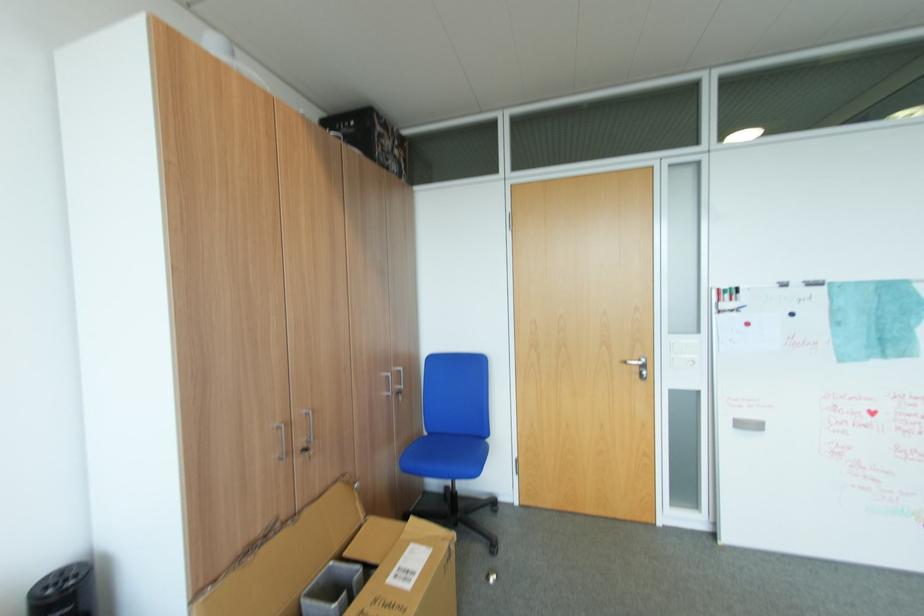
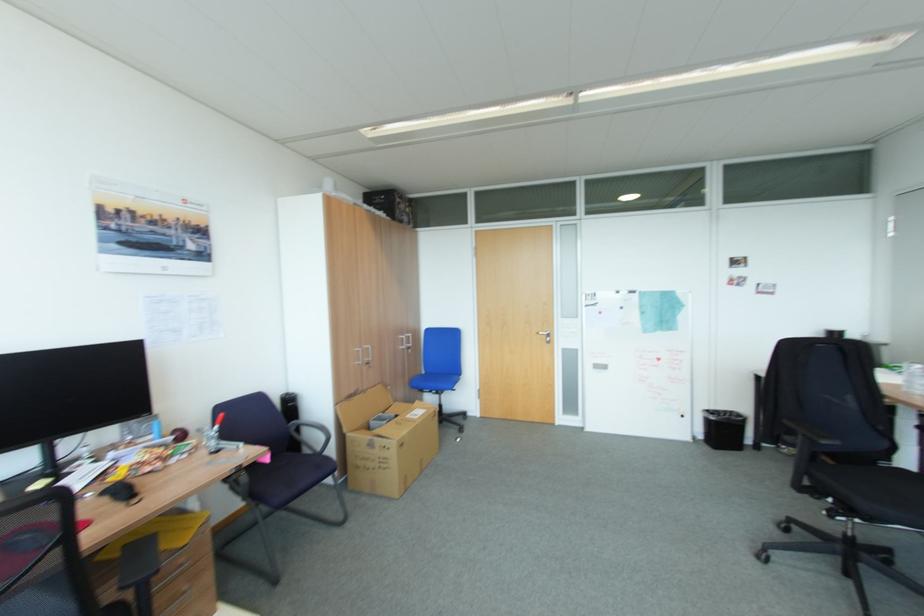
Where in the second image is the point corresponding to (x=408, y=519) from the first image?

(419, 403)